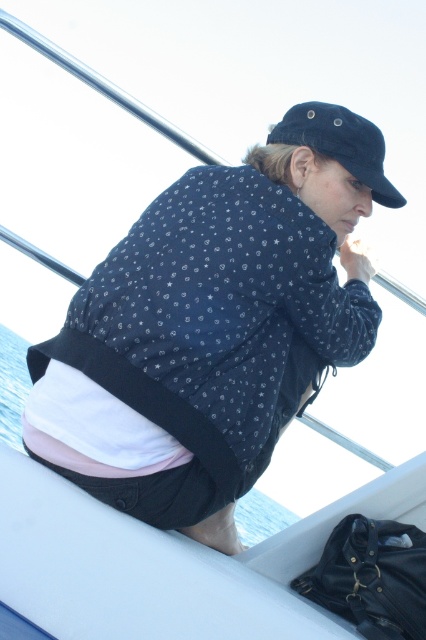
Question: Can you confirm if matte black jacket at center is thinner than blue water at lower left?

Choices:
 (A) yes
 (B) no

Answer: (A)

Question: Considering the relative positions of black matte baseball cap at upper center and blue water at lower left in the image provided, where is black matte baseball cap at upper center located with respect to blue water at lower left?

Choices:
 (A) right
 (B) left

Answer: (A)

Question: Which point appears farthest from the camera in this image?

Choices:
 (A) (348, 138)
 (B) (23, 371)

Answer: (B)

Question: Which object appears closest to the camera in this image?

Choices:
 (A) matte black jacket at center
 (B) blue water at lower left

Answer: (A)

Question: Which of the following is the closest to the observer?

Choices:
 (A) (236, 364)
 (B) (19, 396)

Answer: (A)

Question: Where is black matte baseball cap at upper center located in relation to blue water at lower left in the image?

Choices:
 (A) below
 (B) above

Answer: (B)